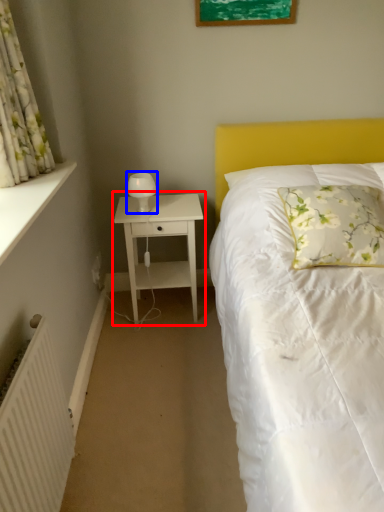
Question: Which object appears closest to the camera in this image, nightstand (highlighted by a red box) or bedside lamp (highlighted by a blue box)?

Choices:
 (A) nightstand
 (B) bedside lamp

Answer: (A)